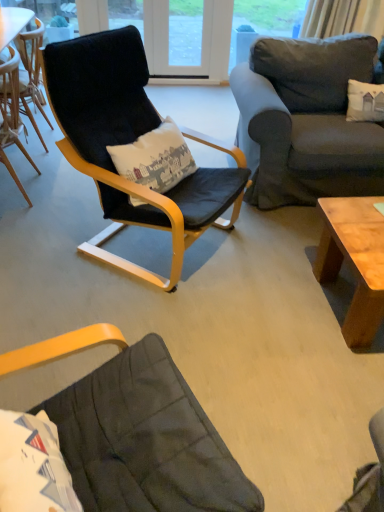
Question: Is light brown wood coffee table at lower right inside or outside of dark gray fabric couch at upper right?

Choices:
 (A) outside
 (B) inside

Answer: (A)

Question: Considering the positions of light brown wood coffee table at lower right and dark gray fabric couch at upper right in the image, is light brown wood coffee table at lower right wider or thinner than dark gray fabric couch at upper right?

Choices:
 (A) wide
 (B) thin

Answer: (B)

Question: Estimate the real-world distances between objects in this image. Which object is closer to the velvet black armchair at center, placed as the first chair when sorted from right to left?

Choices:
 (A) wooden chair at left, the second chair in the right-to-left sequence
 (B) light brown wood coffee table at lower right
 (C) dark gray fabric couch at upper right

Answer: (C)

Question: Which object is positioned farthest from the wooden chair at left, which is counted as the first chair, starting from the left?

Choices:
 (A) light brown wood coffee table at lower right
 (B) dark gray fabric couch at upper right
 (C) velvet black armchair at center, placed as the first chair when sorted from right to left

Answer: (A)